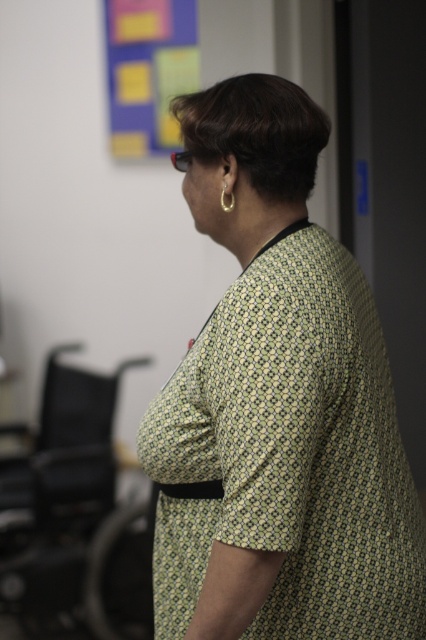
In the scene shown: You are organizing a small event and need to decide where to place a large poster. You have two options in the image provided. Which object, the black plastic swivel chair at left or the multicolored paper at upper left, would be more suitable as a backdrop for the poster based on their sizes?

The black plastic swivel chair at left has a larger size compared to the multicolored paper at upper left, so it would be more suitable as a backdrop for the large poster because it can provide a more stable and visually dominant background.

You are a delivery robot with a height of 1.5 meters. You are positioned at the camera location and need to deliver a package to the black plastic swivel chair at left. The ceiling height in this room is 3 meters. Can you safely move forward without hitting your head?

The ceiling height is 3 meters, and the robot is only 1.5 meters tall, so there is ample clearance. The robot can safely move forward to the black plastic swivel chair at left without hitting its head.